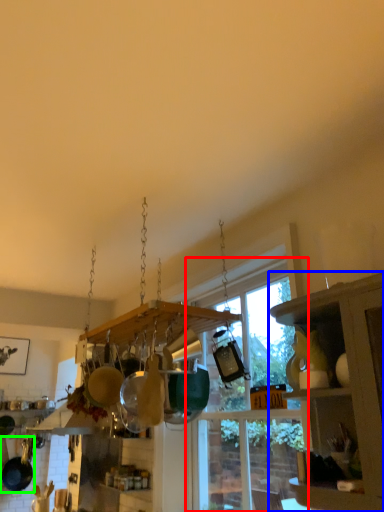
Question: Which object is positioned closest to window (highlighted by a red box)? Select from cabinetry (highlighted by a blue box) and frying pan (highlighted by a green box).

Choices:
 (A) cabinetry
 (B) frying pan

Answer: (A)